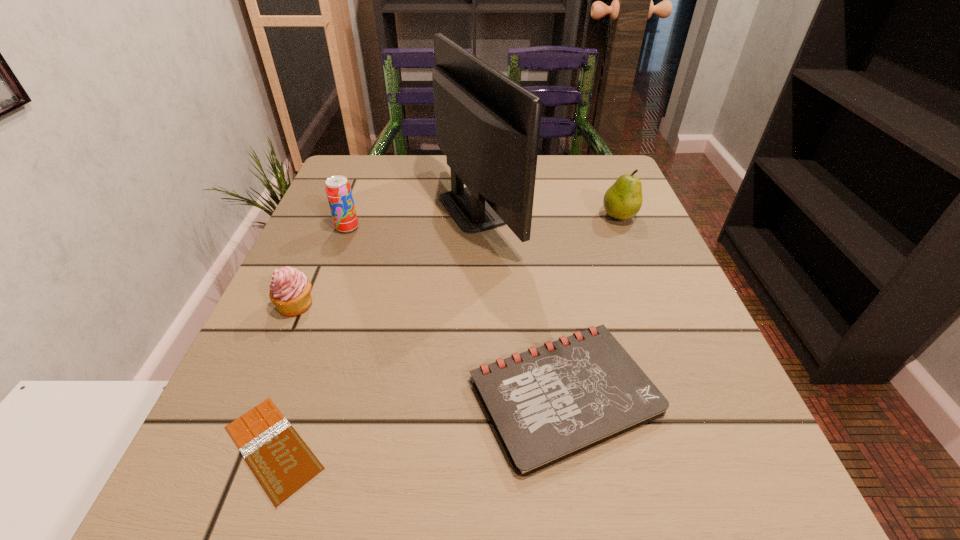
Locate an element on the screen. This screenshot has height=540, width=960. the tallest object is located at coordinates (488, 126).

Where is `the rightmost object`? The width and height of the screenshot is (960, 540). the rightmost object is located at coordinates 623,200.

Image resolution: width=960 pixels, height=540 pixels. I want to click on soda can, so click(338, 190).

What are the coordinates of `the fourth farthest object` in the screenshot? It's located at (290, 289).

This screenshot has width=960, height=540. I want to click on the fourth tallest object, so [x=290, y=289].

Where is `the fifth tallest object`? The height and width of the screenshot is (540, 960). the fifth tallest object is located at coordinates (549, 403).

You are a GUI agent. You are given a task and a screenshot of the screen. Output one action in this format:
    pyautogui.click(x=<x>, y=<y>)
    Task: Click on the chocolate bar
    This screenshot has width=960, height=540.
    Given the screenshot: What is the action you would take?
    pyautogui.click(x=282, y=462)

The image size is (960, 540). Identify the location of vacant region located 0.050m on the front-facing side of the computer monitor. (542, 208).

Locate an element on the screen. Image resolution: width=960 pixels, height=540 pixels. vacant area located on the back of the rightmost object is located at coordinates (595, 159).

Find the location of `vacant region located on the back of the soda can`. vacant region located on the back of the soda can is located at coordinates (359, 197).